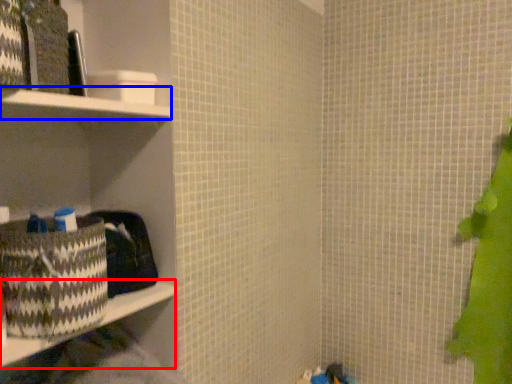
Question: Which object is closer to the camera taking this photo, ledge (highlighted by a red box) or cabinet (highlighted by a blue box)?

Choices:
 (A) ledge
 (B) cabinet

Answer: (B)